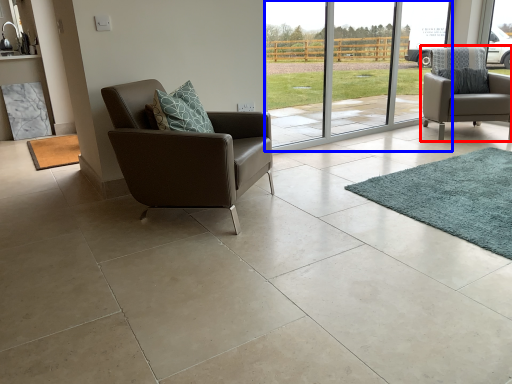
Question: Which object appears closest to the camera in this image, chair (highlighted by a red box) or glass door (highlighted by a blue box)?

Choices:
 (A) chair
 (B) glass door

Answer: (B)